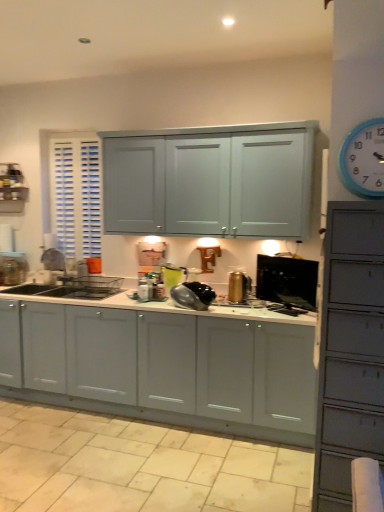
Measure the distance between black glossy monitor at center, arranged as the fourth appliance when viewed from the left, and camera.

A distance of 2.73 meters exists between black glossy monitor at center, arranged as the fourth appliance when viewed from the left, and camera.

How much space does gold metallic kettle at center, the second appliance positioned from the right, occupy vertically?

It is 9.58 inches.

Locate an element on the screen. The width and height of the screenshot is (384, 512). gold metallic kettle at center, the second appliance positioned from the right is located at coordinates (239, 287).

Image resolution: width=384 pixels, height=512 pixels. Find the location of `beige tile at lower center`. beige tile at lower center is located at coordinates (140, 466).

From a real-world perspective, which is physically above, blue plastic clock at upper right or gold metallic kettle at center, positioned as the third appliance in left-to-right order?

blue plastic clock at upper right is physically above.

Is point (374, 170) closer or farther from the camera than point (247, 277)?

Point (374, 170).

From the image's perspective, who appears lower, blue plastic clock at upper right or gold metallic kettle at center, the second appliance positioned from the right?

gold metallic kettle at center, the second appliance positioned from the right, from the image's perspective.

At what (x,y) coordinates should I click in order to perform the action: click on the 2nd appliance counting from the left side of the blue plastic clock at upper right. Please return your answer as a coordinate pair (x, y). Image resolution: width=384 pixels, height=512 pixels. Looking at the image, I should click on (239, 287).

Which is in front, point (142, 300) or point (314, 267)?

The point (314, 267) is more forward.

Between metallic silver toaster at center, the fourth appliance in the right-to-left sequence, and black glossy monitor at center, arranged as the fourth appliance when viewed from the left, which one is positioned in front?

black glossy monitor at center, arranged as the fourth appliance when viewed from the left, is more forward.

Is metallic silver toaster at center, which is the 1th appliance in left-to-right order, not close to black glossy monitor at center, arranged as the fourth appliance when viewed from the left?

No, metallic silver toaster at center, which is the 1th appliance in left-to-right order, is not far away from black glossy monitor at center, arranged as the fourth appliance when viewed from the left.

From the picture: How many degrees apart are the facing directions of metallic silver toaster at center, which is the 1th appliance in left-to-right order, and black glossy monitor at center, arranged as the fourth appliance when viewed from the left?

They differ by 30.9 degrees in their facing directions.

From the image's perspective, who appears lower, matte white cabinets at center or black glossy monitor at center, arranged as the fourth appliance when viewed from the left?

From the image's view, matte white cabinets at center is below.

Considering the relative positions of matte white cabinets at center and black glossy monitor at center, arranged as the fourth appliance when viewed from the left, in the image provided, is matte white cabinets at center to the left of black glossy monitor at center, arranged as the fourth appliance when viewed from the left, from the viewer's perspective?

Yes.

In the image, there is a black glossy monitor at center, which is the 1th appliance from right to left. Where is `cabinetry below it (from a real-world perspective)`? The image size is (384, 512). cabinetry below it (from a real-world perspective) is located at coordinates (167, 364).

Is black glossy monitor at center, arranged as the fourth appliance when viewed from the left, bigger than shiny metallic kettle at center, the second appliance viewed from the left?

Incorrect, black glossy monitor at center, arranged as the fourth appliance when viewed from the left, is not larger than shiny metallic kettle at center, the second appliance viewed from the left.

Is black glossy monitor at center, which is the 1th appliance from right to left, taller or shorter than shiny metallic kettle at center, which is the 3th appliance from right to left?

In the image, black glossy monitor at center, which is the 1th appliance from right to left, appears to be taller than shiny metallic kettle at center, which is the 3th appliance from right to left.

Which object is wider, black glossy monitor at center, which is the 1th appliance from right to left, or shiny metallic kettle at center, which is the 3th appliance from right to left?

With larger width is shiny metallic kettle at center, which is the 3th appliance from right to left.

How much distance is there between black glossy monitor at center, arranged as the fourth appliance when viewed from the left, and shiny metallic kettle at center, which is the 3th appliance from right to left?

21.15 inches.

At what (x,y) coordinates should I click in order to perform the action: click on the 1st appliance above the shiny metallic kettle at center, the second appliance viewed from the left (from a real-world perspective). Please return your answer as a coordinate pair (x, y). This screenshot has width=384, height=512. Looking at the image, I should click on (145, 289).

Could you tell me if shiny metallic kettle at center, which is the 3th appliance from right to left, is turned towards metallic silver toaster at center, the fourth appliance in the right-to-left sequence?

No, shiny metallic kettle at center, which is the 3th appliance from right to left, is not oriented towards metallic silver toaster at center, the fourth appliance in the right-to-left sequence.

Considering the points (189, 303) and (151, 295), which point is behind, point (189, 303) or point (151, 295)?

The point (151, 295) is more distant.

Looking at this image, from the image's perspective, which one is positioned higher, shiny metallic kettle at center, the second appliance viewed from the left, or metallic silver toaster at center, which is the 1th appliance in left-to-right order?

metallic silver toaster at center, which is the 1th appliance in left-to-right order, appears higher in the image.

Is metallic silver toaster at center, which is the 1th appliance in left-to-right order, far from shiny metallic kettle at center, the second appliance viewed from the left?

Actually, metallic silver toaster at center, which is the 1th appliance in left-to-right order, and shiny metallic kettle at center, the second appliance viewed from the left, are a little close together.

Looking at this image, considering the relative sizes of metallic silver toaster at center, the fourth appliance in the right-to-left sequence, and shiny metallic kettle at center, the second appliance viewed from the left, in the image provided, is metallic silver toaster at center, the fourth appliance in the right-to-left sequence, bigger than shiny metallic kettle at center, the second appliance viewed from the left,?

No.

Which object is further away from the camera, metallic silver toaster at center, which is the 1th appliance in left-to-right order, or shiny metallic kettle at center, the second appliance viewed from the left?

metallic silver toaster at center, which is the 1th appliance in left-to-right order.

Which of these two, metallic silver toaster at center, which is the 1th appliance in left-to-right order, or shiny metallic kettle at center, which is the 3th appliance from right to left, is wider?

With larger width is shiny metallic kettle at center, which is the 3th appliance from right to left.

Does black glossy monitor at center, arranged as the fourth appliance when viewed from the left, appear on the right side of blue plastic clock at upper right?

Incorrect, black glossy monitor at center, arranged as the fourth appliance when viewed from the left, is not on the right side of blue plastic clock at upper right.

This screenshot has height=512, width=384. Identify the location of clock that appears in front of the black glossy monitor at center, arranged as the fourth appliance when viewed from the left. (363, 160).

Based on the photo, is black glossy monitor at center, arranged as the fourth appliance when viewed from the left, inside or outside of blue plastic clock at upper right?

black glossy monitor at center, arranged as the fourth appliance when viewed from the left, lies outside blue plastic clock at upper right.

Find the location of a particular element. clock lying in front of the gold metallic kettle at center, the second appliance positioned from the right is located at coordinates [363, 160].

From a real-world perspective, starting from the black glossy monitor at center, arranged as the fourth appliance when viewed from the left, which appliance is the 2nd one below it? Please provide its 2D coordinates.

[(145, 289)]

Based on their spatial positions, is blue plastic clock at upper right or metallic silver toaster at center, which is the 1th appliance in left-to-right order, closer to beige tile at lower center?

Based on the image, metallic silver toaster at center, which is the 1th appliance in left-to-right order, appears to be nearer to beige tile at lower center.

From the image, which object appears to be farther from beige tile at lower center, shiny metallic kettle at center, the second appliance viewed from the left, or blue plastic clock at upper right?

Based on the image, blue plastic clock at upper right appears to be further to beige tile at lower center.

When comparing their distances from blue plastic clock at upper right, does gold metallic kettle at center, positioned as the third appliance in left-to-right order, or shiny metallic kettle at center, the second appliance viewed from the left, seem closer?

shiny metallic kettle at center, the second appliance viewed from the left.

Looking at the image, which one is located further to shiny metallic kettle at center, the second appliance viewed from the left, matte white cabinets at center or gold metallic kettle at center, the second appliance positioned from the right?

The object further to shiny metallic kettle at center, the second appliance viewed from the left, is matte white cabinets at center.

When comparing their distances from blue plastic clock at upper right, does gold metallic kettle at center, the second appliance positioned from the right, or beige tile at lower center seem closer?

gold metallic kettle at center, the second appliance positioned from the right, lies closer to blue plastic clock at upper right than the other object.

Looking at the image, which one is located further to shiny metallic kettle at center, which is the 3th appliance from right to left, blue plastic clock at upper right or gold metallic kettle at center, positioned as the third appliance in left-to-right order?

blue plastic clock at upper right lies further to shiny metallic kettle at center, which is the 3th appliance from right to left, than the other object.

Which object lies further to the anchor point shiny metallic kettle at center, which is the 3th appliance from right to left, blue plastic clock at upper right or metallic silver toaster at center, which is the 1th appliance in left-to-right order?

The object further to shiny metallic kettle at center, which is the 3th appliance from right to left, is blue plastic clock at upper right.

Considering their positions, is gold metallic kettle at center, the second appliance positioned from the right, positioned further to blue plastic clock at upper right than black glossy monitor at center, which is the 1th appliance from right to left?

gold metallic kettle at center, the second appliance positioned from the right, is positioned further to the anchor blue plastic clock at upper right.

Locate an element on the screen. The width and height of the screenshot is (384, 512). appliance located between metallic silver toaster at center, the fourth appliance in the right-to-left sequence, and gold metallic kettle at center, the second appliance positioned from the right, in the left-right direction is located at coordinates (193, 295).

I want to click on cabinetry that lies between blue plastic clock at upper right and beige tile at lower center from top to bottom, so click(x=167, y=364).

You are a GUI agent. You are given a task and a screenshot of the screen. Output one action in this format:
    pyautogui.click(x=<x>, y=<y>)
    Task: Click on the cabinetry located between beige tile at lower center and gold metallic kettle at center, positioned as the third appliance in left-to-right order, in the depth direction
    This screenshot has width=384, height=512.
    Given the screenshot: What is the action you would take?
    pyautogui.click(x=167, y=364)

Identify the location of appliance between beige tile at lower center and shiny metallic kettle at center, which is the 3th appliance from right to left, along the z-axis. (287, 283).